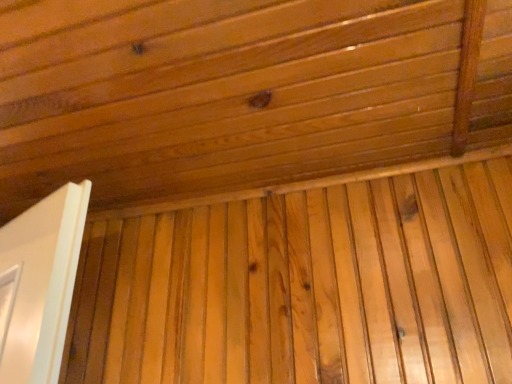
Question: Does point (288, 104) appear closer or farther from the camera than point (485, 365)?

Choices:
 (A) farther
 (B) closer

Answer: (A)

Question: From the image's perspective, is natural wood ceiling at upper center positioned above or below natural wood plywood at center?

Choices:
 (A) above
 (B) below

Answer: (A)

Question: Considering the positions of natural wood ceiling at upper center and natural wood plywood at center in the image, is natural wood ceiling at upper center taller or shorter than natural wood plywood at center?

Choices:
 (A) tall
 (B) short

Answer: (B)

Question: Looking at the image, does natural wood plywood at center seem bigger or smaller compared to natural wood ceiling at upper center?

Choices:
 (A) big
 (B) small

Answer: (B)

Question: From a real-world perspective, is natural wood plywood at center above or below natural wood ceiling at upper center?

Choices:
 (A) below
 (B) above

Answer: (A)

Question: Is natural wood plywood at center to the left or to the right of natural wood ceiling at upper center in the image?

Choices:
 (A) left
 (B) right

Answer: (B)

Question: Which is correct: natural wood plywood at center is inside natural wood ceiling at upper center, or outside of it?

Choices:
 (A) outside
 (B) inside

Answer: (A)